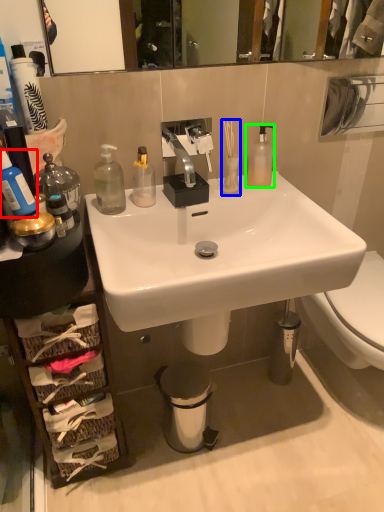
Question: Which object is the closest to the bottle (highlighted by a red box)? Choose among these: toiletry (highlighted by a blue box) or bottle (highlighted by a green box).

Choices:
 (A) toiletry
 (B) bottle

Answer: (A)